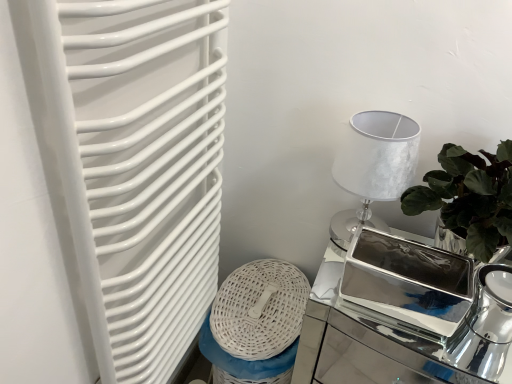
This screenshot has width=512, height=384. I want to click on white glossy radiator at left, so click(x=134, y=164).

What do you see at coordinates (485, 325) in the screenshot? The height and width of the screenshot is (384, 512). I see `polished silver tea pot at right` at bounding box center [485, 325].

Describe the element at coordinates (364, 334) in the screenshot. I see `polished silver tray at right` at that location.

Where is `white glossy radiator at left`? white glossy radiator at left is located at coordinates (134, 164).

Is silver metallic table lamp at upper right facing away from polished silver tray at right?

No, silver metallic table lamp at upper right is not facing away from polished silver tray at right.

The image size is (512, 384). I want to click on table lamp located above the polished silver tray at right (from a real-world perspective), so click(x=373, y=167).

Is polished silver tray at right inside silver metallic table lamp at upper right?

No, polished silver tray at right is located outside of silver metallic table lamp at upper right.

Which is nearer, (355, 172) or (358, 381)?

Positioned in front is point (355, 172).

Is polished silver tray at right smaller than white glossy radiator at left?

Incorrect, polished silver tray at right is not smaller in size than white glossy radiator at left.

Considering the relative sizes of polished silver tray at right and white glossy radiator at left in the image provided, is polished silver tray at right shorter than white glossy radiator at left?

Yes.

Choose the correct answer: Is polished silver tray at right inside white glossy radiator at left or outside it?

polished silver tray at right is not enclosed by white glossy radiator at left.

From a real-world perspective, is polished silver tray at right beneath white glossy radiator at left?

Yes, from a real-world perspective, polished silver tray at right is beneath white glossy radiator at left.

Between white glossy radiator at left and silver metallic table lamp at upper right, which one has larger size?

Bigger between the two is white glossy radiator at left.

In the image, is white glossy radiator at left positioned in front of or behind silver metallic table lamp at upper right?

Visually, white glossy radiator at left is located in front of silver metallic table lamp at upper right.

Between white glossy radiator at left and silver metallic table lamp at upper right, which one has larger width?

silver metallic table lamp at upper right is wider.

Which is in front, point (114, 211) or point (362, 147)?

Positioned in front is point (114, 211).

Looking at the image, does polished silver tray at right seem bigger or smaller compared to polished silver tea pot at right?

In the image, polished silver tray at right appears to be larger than polished silver tea pot at right.

From a real-world perspective, is polished silver tray at right over polished silver tea pot at right?

No, from a real-world perspective, polished silver tray at right is not on top of polished silver tea pot at right.

Between polished silver tray at right and polished silver tea pot at right, which one has larger width?

polished silver tray at right.

From the image's perspective, which object appears higher, polished silver tray at right or polished silver tea pot at right?

polished silver tea pot at right, from the image's perspective.

Considering the relative sizes of polished silver tea pot at right and silver metallic table lamp at upper right in the image provided, is polished silver tea pot at right taller than silver metallic table lamp at upper right?

No, polished silver tea pot at right is not taller than silver metallic table lamp at upper right.

Measure the distance from polished silver tea pot at right to silver metallic table lamp at upper right.

The distance of polished silver tea pot at right from silver metallic table lamp at upper right is 13.06 inches.

Does polished silver tea pot at right turn towards silver metallic table lamp at upper right?

No, polished silver tea pot at right does not turn towards silver metallic table lamp at upper right.

Does point (469, 338) lie behind point (380, 164)?

Yes.

Considering the relative sizes of white glossy radiator at left and polished silver tea pot at right in the image provided, is white glossy radiator at left taller than polished silver tea pot at right?

Yes.

Considering the relative positions of white glossy radiator at left and polished silver tea pot at right in the image provided, is white glossy radiator at left to the right of polished silver tea pot at right from the viewer's perspective?

No.

Is white glossy radiator at left not within polished silver tea pot at right?

Absolutely, white glossy radiator at left is external to polished silver tea pot at right.

Between white glossy radiator at left and polished silver tea pot at right, which one is positioned in front?

Positioned in front is white glossy radiator at left.

Which is in front, point (379, 121) or point (496, 307)?

Point (496, 307)

In terms of height, does silver metallic table lamp at upper right look taller or shorter compared to polished silver tea pot at right?

In the image, silver metallic table lamp at upper right appears to be taller than polished silver tea pot at right.

The width and height of the screenshot is (512, 384). I want to click on table lamp on the left of polished silver tea pot at right, so click(x=373, y=167).

Between silver metallic table lamp at upper right and polished silver tea pot at right, which one is positioned in front?

Positioned in front is polished silver tea pot at right.

Find the location of a particular element. table lamp behind the polished silver tray at right is located at coordinates (373, 167).

Image resolution: width=512 pixels, height=384 pixels. Identify the location of table located below the white glossy radiator at left (from the image's perspective). (364, 334).

Considering their positions, is white glossy radiator at left positioned further to silver metallic table lamp at upper right than polished silver tray at right?

white glossy radiator at left is further to silver metallic table lamp at upper right.

From the image, which object appears to be nearer to polished silver tea pot at right, silver metallic table lamp at upper right or polished silver tray at right?

The object closer to polished silver tea pot at right is silver metallic table lamp at upper right.

Looking at the image, which one is located further to polished silver tea pot at right, silver metallic table lamp at upper right or white glossy radiator at left?

white glossy radiator at left lies further to polished silver tea pot at right than the other object.

From the image, which object appears to be nearer to polished silver tray at right, silver metallic table lamp at upper right or white glossy radiator at left?

Among the two, silver metallic table lamp at upper right is located nearer to polished silver tray at right.

Based on their spatial positions, is polished silver tea pot at right or silver metallic table lamp at upper right closer to white glossy radiator at left?

silver metallic table lamp at upper right is closer to white glossy radiator at left.

From the image, which object appears to be farther from white glossy radiator at left, silver metallic table lamp at upper right or polished silver tea pot at right?

The object further to white glossy radiator at left is polished silver tea pot at right.

From the picture: Based on their spatial positions, is silver metallic table lamp at upper right or polished silver tea pot at right closer to polished silver tray at right?

The object closer to polished silver tray at right is silver metallic table lamp at upper right.

From the image, which object appears to be farther from polished silver tea pot at right, polished silver tray at right or silver metallic table lamp at upper right?

polished silver tray at right.

Locate an element on the screen. This screenshot has width=512, height=384. tea pot that lies between silver metallic table lamp at upper right and polished silver tray at right from top to bottom is located at coordinates (485, 325).

Locate an element on the screen. table lamp situated between white glossy radiator at left and polished silver tea pot at right from left to right is located at coordinates pos(373,167).

You are a GUI agent. You are given a task and a screenshot of the screen. Output one action in this format:
    pyautogui.click(x=<x>, y=<y>)
    Task: Click on the table located between white glossy radiator at left and polished silver tea pot at right in the left-right direction
    The width and height of the screenshot is (512, 384).
    Given the screenshot: What is the action you would take?
    (x=364, y=334)

The width and height of the screenshot is (512, 384). Identify the location of table lamp between white glossy radiator at left and polished silver tray at right. tap(373, 167).